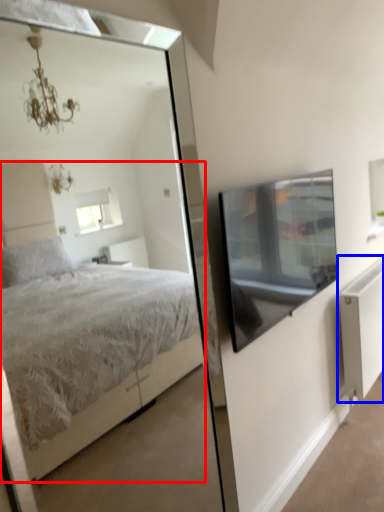
Question: Which of the following is the farthest to the observer, bed (highlighted by a red box) or radiator (highlighted by a blue box)?

Choices:
 (A) bed
 (B) radiator

Answer: (B)